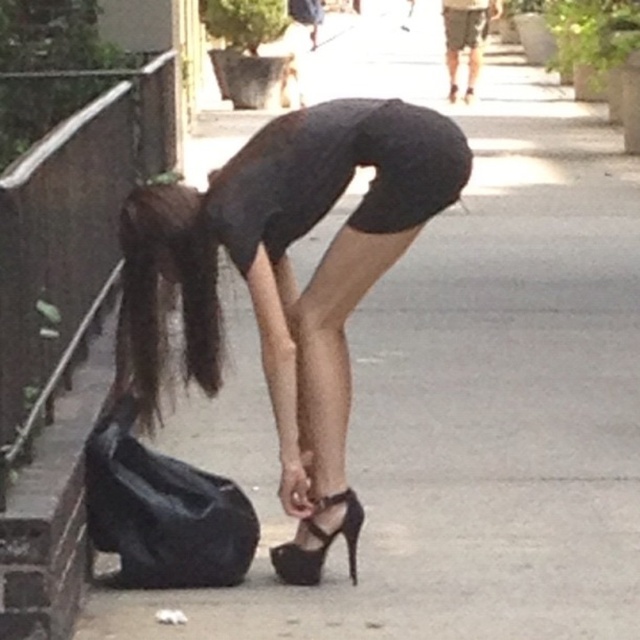
Measure the distance between black leather high heels at center and black patent leather high-heeled shoe at center.

black leather high heels at center is 14.02 meters away from black patent leather high-heeled shoe at center.

Does black leather high heels at center have a lesser height compared to black patent leather high-heeled shoe at center?

In fact, black leather high heels at center may be taller than black patent leather high-heeled shoe at center.

Is point (355, 141) less distant than point (448, 93)?

Yes, point (355, 141) is closer to viewer.

The image size is (640, 640). Identify the location of black leather high heels at center. (288, 282).

Does black leather high heels at center appear on the left side of black leather high-heeled sandal at lower center?

Indeed, black leather high heels at center is positioned on the left side of black leather high-heeled sandal at lower center.

Is black leather high heels at center taller than black leather high-heeled sandal at lower center?

Correct, black leather high heels at center is much taller as black leather high-heeled sandal at lower center.

Between point (332, 442) and point (285, 552), which one is positioned in front?

Point (332, 442) is more forward.

This screenshot has height=640, width=640. What are the coordinates of `black leather high heels at center` in the screenshot? It's located at (288, 282).

Locate an element on the screen. This screenshot has width=640, height=640. black leather high-heeled sandal at lower center is located at coordinates (321, 544).

Identify the location of black leather high-heeled sandal at lower center. The height and width of the screenshot is (640, 640). (321, 544).